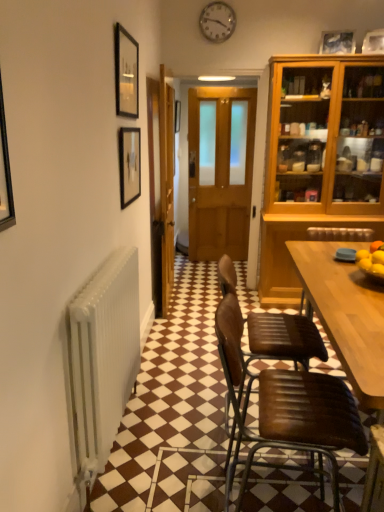
Question: From the image's perspective, relative to wooden door at center, which is the second door from left to right, is white metallic radiator at left above or below?

Choices:
 (A) above
 (B) below

Answer: (B)

Question: Which is correct: white metallic radiator at left is inside wooden door at center, the 1th door from the right, or outside of it?

Choices:
 (A) outside
 (B) inside

Answer: (A)

Question: Estimate the real-world distances between objects in this image. Which object is farther from the white metallic radiator at left?

Choices:
 (A) wooden door at center, arranged as the first door when viewed from the left
 (B) wooden door at center, the 1th door from the right
 (C) brown leather chair at center, which is the 1th chair in back-to-front order
 (D) brown leather chair at lower right
 (E) matte black picture frame at upper left, arranged as the 3th picture frame when viewed from the right

Answer: (B)

Question: Which object is the closest to the wooden door at center, the 1th door from the right?

Choices:
 (A) matte black picture frame at upper right, arranged as the third picture frame when viewed from the left
 (B) brown leather chair at lower right
 (C) brown leather chair at center, which is the 1th chair in back-to-front order
 (D) matte black picture frame at upper left, which is the third picture frame in top-to-bottom order
 (E) brown leather chair at lower right, acting as the first chair starting from the front

Answer: (B)